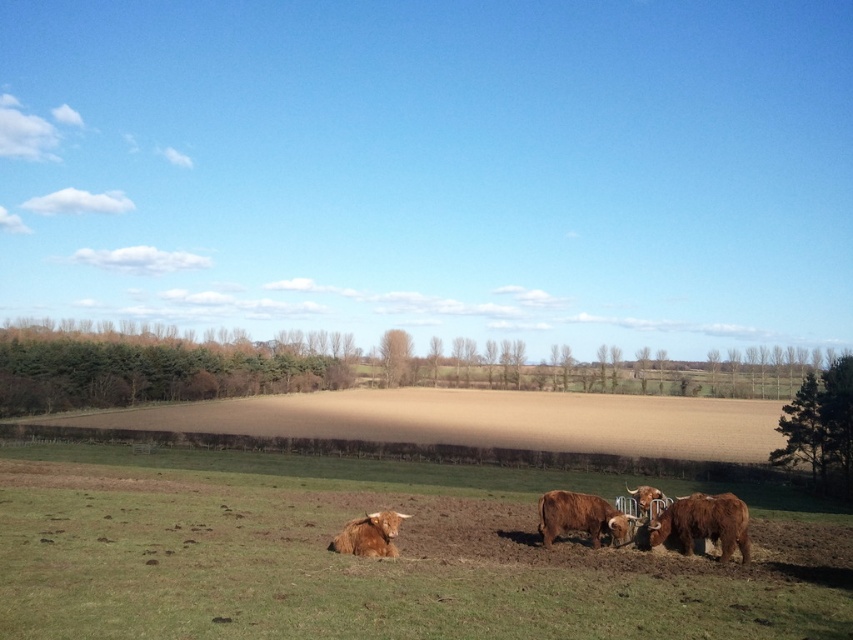
Based on the photo, is the position of brown furry bull at lower right more distant than that of brown furry bull at center?

No, it is in front of brown furry bull at center.

Between brown furry bull at lower right and brown furry bull at center, which one has less height?

brown furry bull at lower right

Where is `brown furry bull at lower right`? The width and height of the screenshot is (853, 640). brown furry bull at lower right is located at coordinates (703, 524).

Can you confirm if brown soil at center is positioned below brown furry bull at lower center?

Yes, brown soil at center is below brown furry bull at lower center.

Locate an element on the screen. This screenshot has height=640, width=853. brown soil at center is located at coordinates (474, 420).

Where is `brown soil at center`? brown soil at center is located at coordinates (474, 420).

Can you confirm if green grassy field at lower center is taller than brown furry bull at center?

Yes.

Who is more forward, (502, 541) or (608, 516)?

Point (608, 516) is in front.

Is point (428, 477) behind point (624, 525)?

Yes, point (428, 477) is behind point (624, 525).

Find the location of a particular element. green grassy field at lower center is located at coordinates (373, 560).